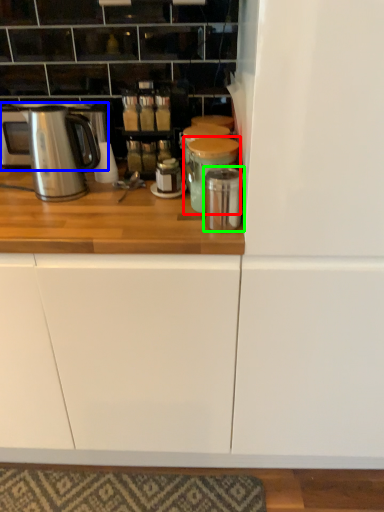
Question: Which is nearer to the appliance (highlighted by a red box)? home appliance (highlighted by a blue box) or appliance (highlighted by a green box).

Choices:
 (A) home appliance
 (B) appliance

Answer: (B)